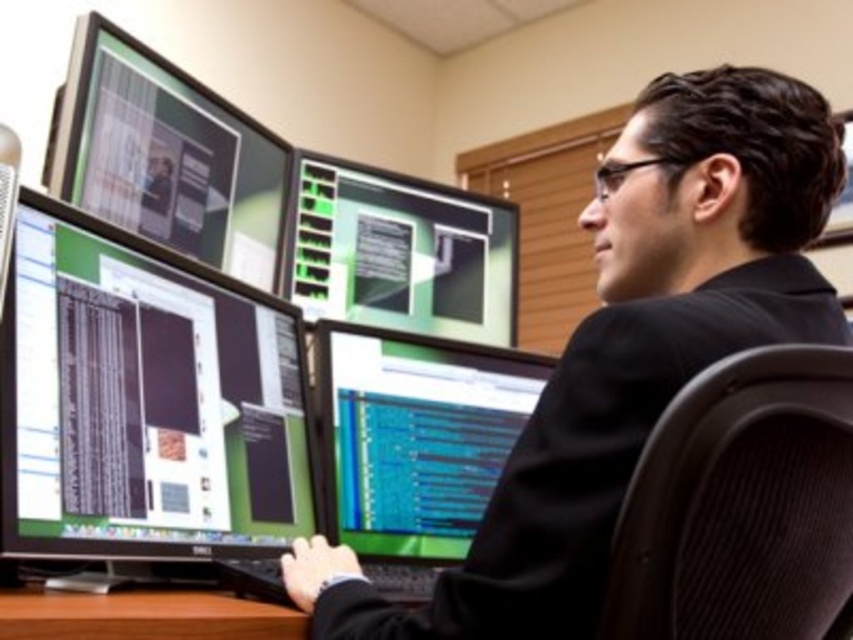
Between matte black monitor at center and black glossy monitor at left, which one is positioned lower?

matte black monitor at center

Is point (399, 352) behind point (1, 128)?

No, it is not.

What are the coordinates of `matte black monitor at center` in the screenshot? It's located at (415, 435).

Can you confirm if black glossy suit at center is bigger than matte black monitor at center?

Indeed, black glossy suit at center has a larger size compared to matte black monitor at center.

Is the position of black glossy suit at center more distant than that of matte black monitor at center?

No, black glossy suit at center is in front of matte black monitor at center.

You are a GUI agent. You are given a task and a screenshot of the screen. Output one action in this format:
    pyautogui.click(x=<x>, y=<y>)
    Task: Click on the black glossy suit at center
    The height and width of the screenshot is (640, 853).
    Given the screenshot: What is the action you would take?
    pyautogui.click(x=630, y=349)

Is matte black monitor at center positioned before brown wood table at lower center?

No, matte black monitor at center is behind brown wood table at lower center.

Who is positioned more to the left, matte black monitor at center or brown wood table at lower center?

brown wood table at lower center

Between point (368, 372) and point (28, 609), which one is positioned in front?

Positioned in front is point (28, 609).

Locate an element on the screen. The image size is (853, 640). matte black monitor at center is located at coordinates (415, 435).